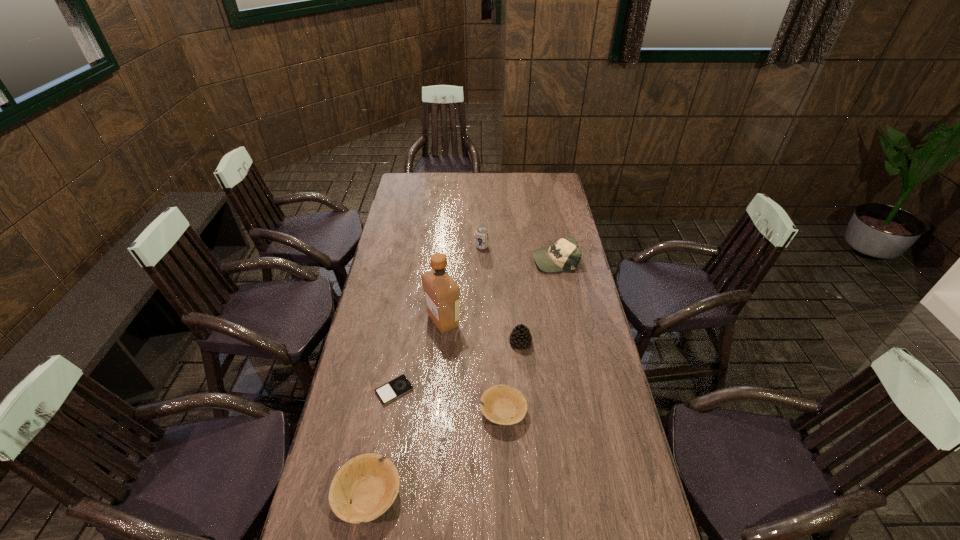
Please show where to add a bowl on the right while keeping spacing even. Please provide its 2D coordinates. Your answer should be formatted as a tuple, i.e. [(x, y)], where the tuple contains the x and y coordinates of a point satisfying the conditions above.

[(606, 348)]